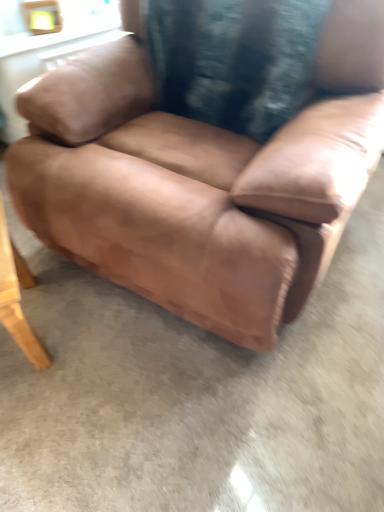
Question: In terms of width, does wooden table at lower left look wider or thinner when compared to velvety black pillow at center?

Choices:
 (A) thin
 (B) wide

Answer: (B)

Question: In the image, is wooden table at lower left positioned in front of or behind velvety black pillow at center?

Choices:
 (A) behind
 (B) front

Answer: (B)

Question: Which of these objects is positioned closest to the wooden table at lower left?

Choices:
 (A) velvety black pillow at center
 (B) brown leather chair at center

Answer: (B)

Question: Which is nearer to the wooden table at lower left?

Choices:
 (A) brown leather chair at center
 (B) velvety black pillow at center

Answer: (A)